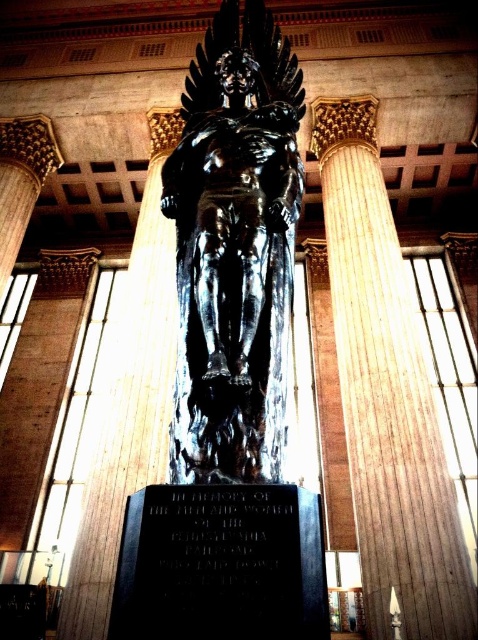
Does black polished statue at center lie in front of black stone plaque at center?

No, it is behind black stone plaque at center.

Who is more forward, (210, 220) or (180, 566)?

Positioned in front is point (180, 566).

Locate an element on the screen. The width and height of the screenshot is (478, 640). black polished statue at center is located at coordinates (235, 248).

Which is more to the right, smooth beige column at center or black stone plaque at center?

From the viewer's perspective, smooth beige column at center appears more on the right side.

Who is taller, smooth beige column at center or black stone plaque at center?

smooth beige column at center

The height and width of the screenshot is (640, 478). In order to click on smooth beige column at center in this screenshot , I will do `click(387, 396)`.

Does black polished statue at center have a lesser width compared to smooth beige column at center?

Yes, black polished statue at center is thinner than smooth beige column at center.

From the picture: Who is more distant from viewer, (279, 42) or (377, 577)?

The point (377, 577) is more distant.

Where is `black polished statue at center`? The height and width of the screenshot is (640, 478). black polished statue at center is located at coordinates (235, 248).